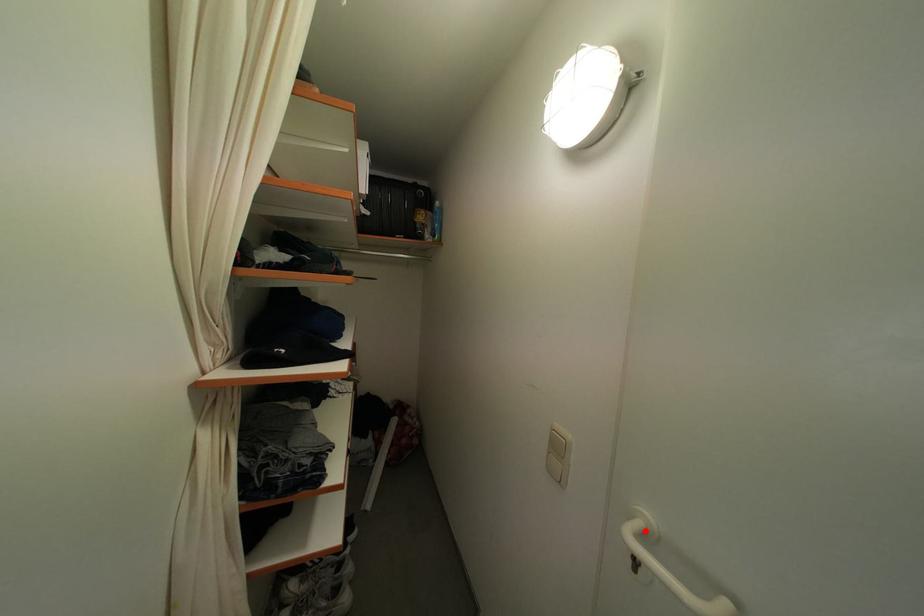
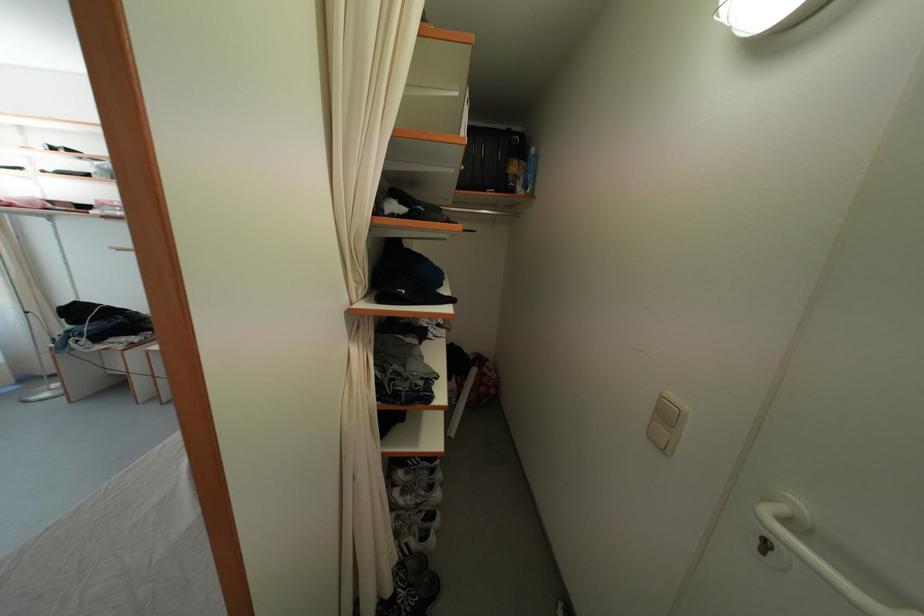
Where in the second image is the point corresponding to the highlighted location from the first image?

(787, 515)